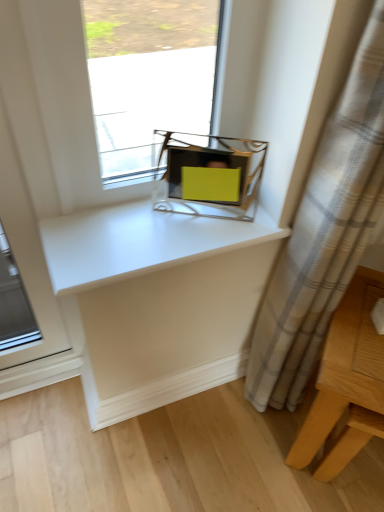
Identify the location of blank area to the left of matte yellow plastic at center. The width and height of the screenshot is (384, 512). (135, 218).